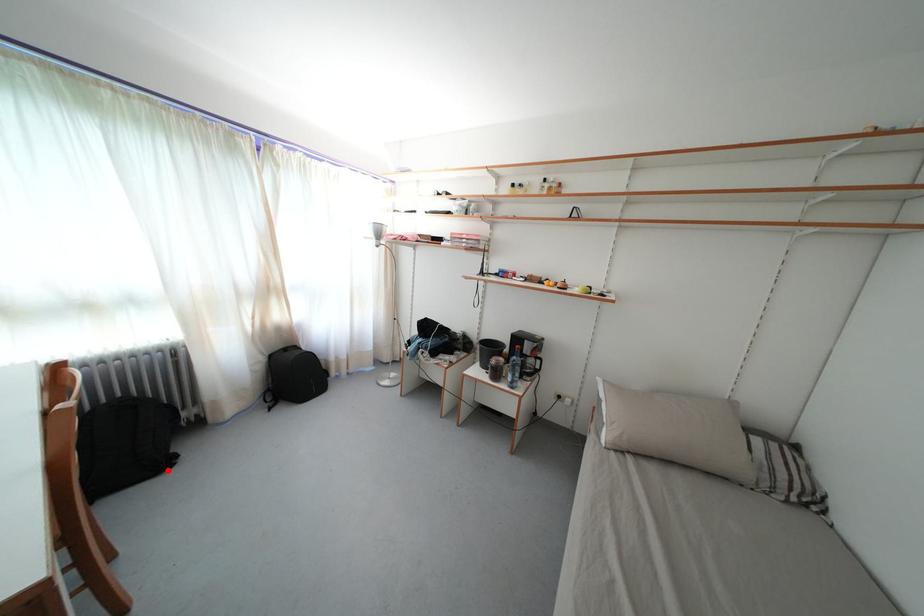
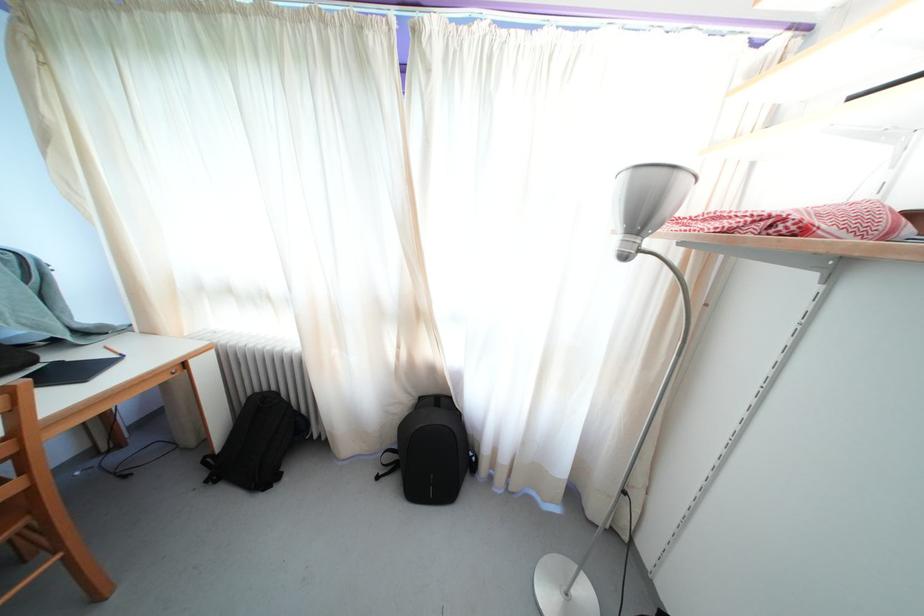
Question: I am providing you with two images of the same scene from different viewpoints. In image1, a red point is highlighted. Considering the same 3D point in image2, which of the following is correct?

Choices:
 (A) It is closer
 (B) It is farther

Answer: (A)